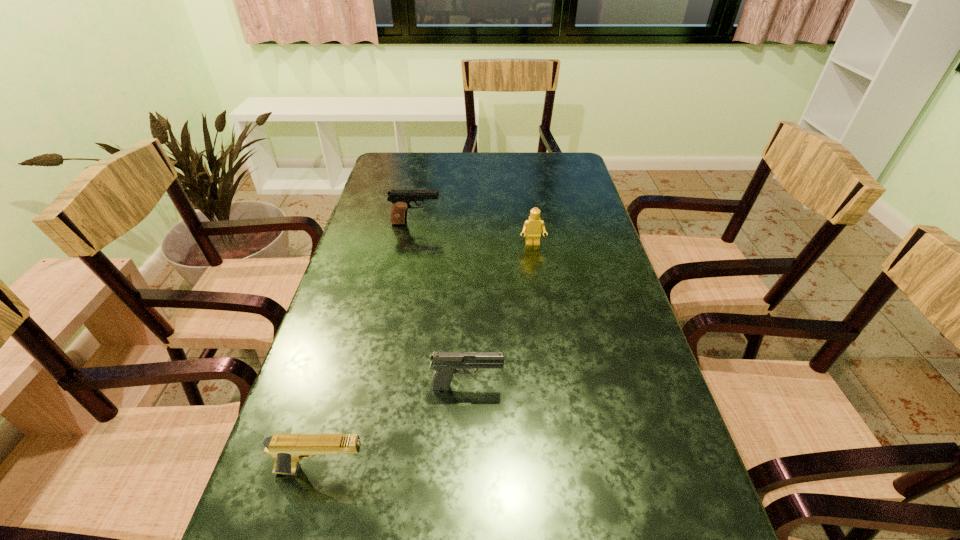
Image resolution: width=960 pixels, height=540 pixels. What are the coordinates of `free area in between the farthest object and the second nearest object` in the screenshot? It's located at (442, 305).

The height and width of the screenshot is (540, 960). I want to click on vacant area that lies between the second nearest object and the farthest object, so click(x=442, y=305).

Where is `vacant space that is in between the rightmost pistol and the rightmost object`? The height and width of the screenshot is (540, 960). vacant space that is in between the rightmost pistol and the rightmost object is located at coordinates (500, 315).

Locate an element on the screen. free space between the nearest object and the third nearest object is located at coordinates (427, 357).

At what (x,y) coordinates should I click in order to perform the action: click on free spot between the rightmost pistol and the third nearest object. Please return your answer as a coordinate pair (x, y). The image size is (960, 540). Looking at the image, I should click on (500, 315).

Find the location of a particular element. Image resolution: width=960 pixels, height=540 pixels. the closest object to the farthest object is located at coordinates (532, 226).

Find the location of a particular element. The width and height of the screenshot is (960, 540). the third closest object to the farthest object is located at coordinates (287, 449).

Identify which pistol is the second closest to the farthest object. Please provide its 2D coordinates. Your answer should be formatted as a tuple, i.e. [(x, y)], where the tuple contains the x and y coordinates of a point satisfying the conditions above.

[(287, 449)]

Choose which pistol is the second nearest neighbor to the farthest pistol. Please provide its 2D coordinates. Your answer should be formatted as a tuple, i.e. [(x, y)], where the tuple contains the x and y coordinates of a point satisfying the conditions above.

[(287, 449)]

Where is `vacant space that satisfies the following two spatial constraints: 1. on the face of the Lego; 2. at the barrel of the nearest pistol`? vacant space that satisfies the following two spatial constraints: 1. on the face of the Lego; 2. at the barrel of the nearest pistol is located at coordinates (566, 470).